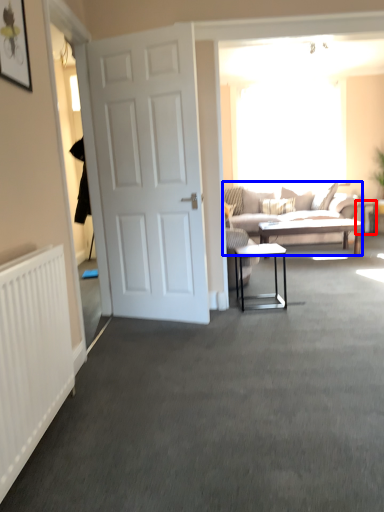
Question: Which point is further to the camera, side table (highlighted by a red box) or studio couch (highlighted by a blue box)?

Choices:
 (A) side table
 (B) studio couch

Answer: (A)